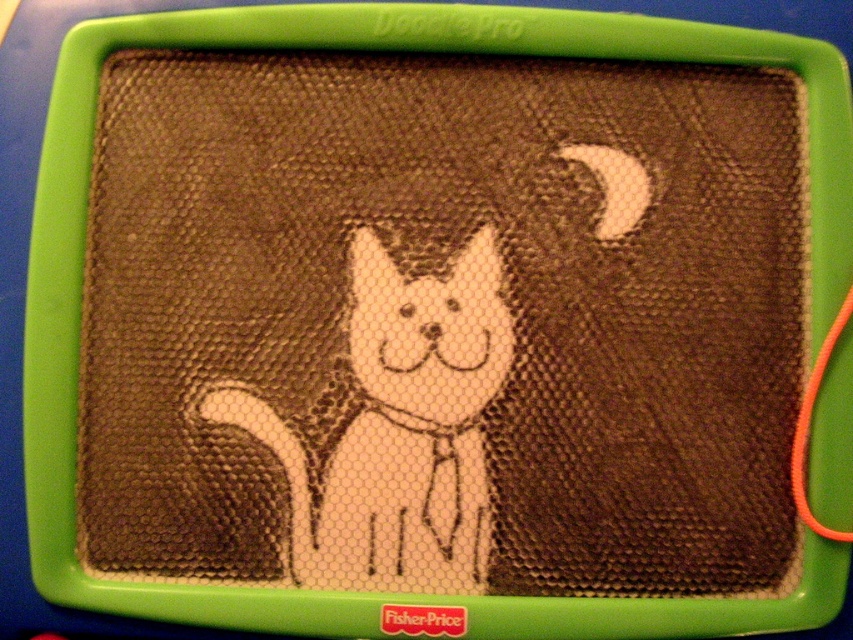
You want to place a sticker on the brown textured screen at center that covers the entire white paper cat at center. Based on the description, will the sticker need to be larger or smaller than the cat to fully cover it?

The brown textured screen at center is larger than the white paper cat at center, so the sticker needs to be at least as large as the cat to fully cover it. Since the screen is bigger, the sticker size just needs to match the cat.

You are holding the DoodlePro tablet and want to touch the point at coordinates point (x=576, y=301) on its surface. Given that your hand is 29.07 inches away from this point, can you reach it without moving your arm?

The point (x=576, y=301) is 29.07 inches away from the viewer, so yes, you can reach it without moving your arm since the distance matches the required reach.